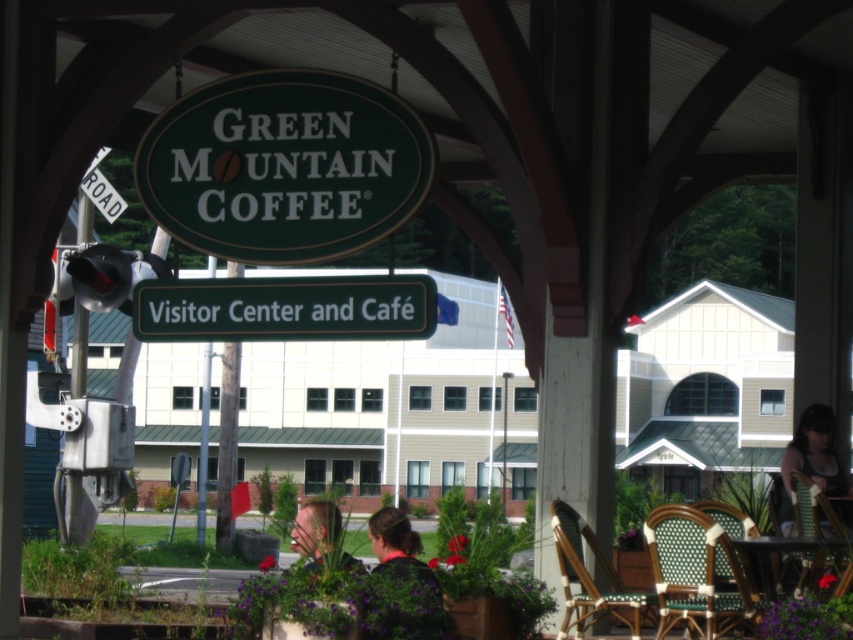
You are a barista carrying a tray of coffee cups. You need to move from your current position near the dark brown hair at lower center to the wooden table at lower right to place the cups. Considering the tray is 1.2 meters wide, is there enough space to maneuver safely between these two points?

The distance between the dark brown hair at lower center and the wooden table at lower right is 2.82 meters. Since the tray is 1.2 meters wide, there is sufficient space to maneuver safely as the distance is greater than the tray width.

You are a photographer taking a picture of the Green Mountain Coffee Visitor Center and want to include both the matte black tank top at lower right and the blonde hair at center in your shot. Which object is located more to the right side of the frame?

The matte black tank top at lower right is positioned on the right side of blonde hair at center, so it is more to the right in the frame.

You are standing at the Green Mountain Coffee Visitor Center and want to reach the flagpole. The flagpole is located at point (798, 461). If you can walk 20 meters in 1 minute, how long will it take you to reach the flagpole?

The distance between you and the flagpole at point (798, 461) is 18.19 meters. Since you can walk 20 meters in 1 minute, it will take you approximately 55 seconds to reach the flagpole at point (798, 461).